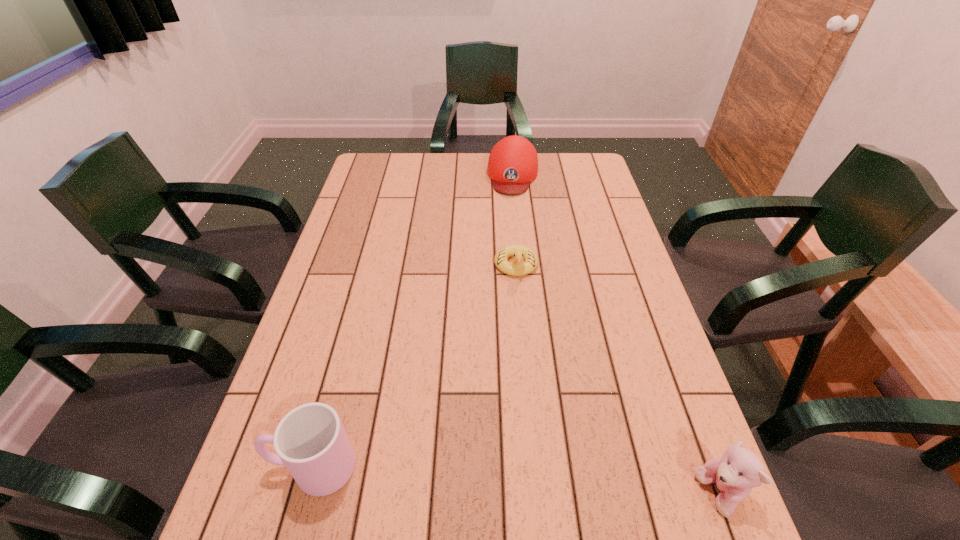
The width and height of the screenshot is (960, 540). I want to click on cup, so click(x=310, y=440).

The height and width of the screenshot is (540, 960). In order to click on teddy bear in this screenshot , I will do `click(739, 470)`.

This screenshot has width=960, height=540. Find the location of `baseball cap`. baseball cap is located at coordinates (513, 162).

At what (x,y) coordinates should I click in order to perform the action: click on the third nearest object. Please return your answer as a coordinate pair (x, y). This screenshot has width=960, height=540. Looking at the image, I should click on (519, 268).

The height and width of the screenshot is (540, 960). Find the location of `the shortest object`. the shortest object is located at coordinates [519, 268].

Locate an element on the screen. This screenshot has width=960, height=540. vacant area situated at the face of the teddy bear is located at coordinates (622, 494).

This screenshot has width=960, height=540. Find the location of `free space located 0.180m at the face of the teddy bear`. free space located 0.180m at the face of the teddy bear is located at coordinates point(601,494).

Find the location of a particular element. The image size is (960, 540). free space located at the face of the teddy bear is located at coordinates (665, 494).

In order to click on vacant position located on the front-facing side of the farthest object in this screenshot , I will do `click(507, 242)`.

Where is `free spot located 0.300m on the front-facing side of the farthest object`? This screenshot has height=540, width=960. free spot located 0.300m on the front-facing side of the farthest object is located at coordinates (506, 253).